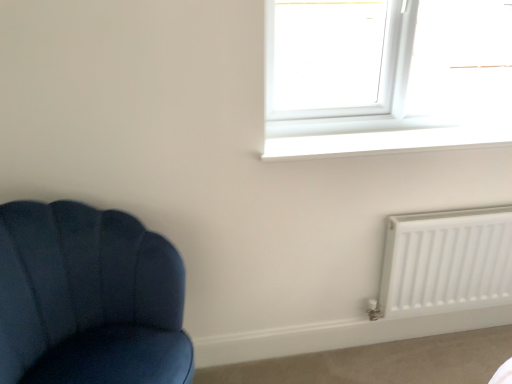
What is the approximate width of white smooth window sill at upper center?

white smooth window sill at upper center is 11.72 inches wide.

Looking at this image, measure the distance between white plastic window at upper right and camera.

white plastic window at upper right is 4.23 feet away from camera.

Measure the distance between point (511, 87) and camera.

A distance of 5.63 feet exists between point (511, 87) and camera.

Identify the location of white smooth window sill at upper center. The width and height of the screenshot is (512, 384). (389, 141).

Considering the positions of objects white matte radiator at lower right and velvet blue chair at left in the image provided, who is more to the right, white matte radiator at lower right or velvet blue chair at left?

white matte radiator at lower right.

Based on the photo, from the image's perspective, is white matte radiator at lower right positioned above or below velvet blue chair at left?

Based on their image positions, white matte radiator at lower right is located above velvet blue chair at left.

Is white matte radiator at lower right further to the viewer compared to velvet blue chair at left?

Yes, white matte radiator at lower right is behind velvet blue chair at left.

This screenshot has width=512, height=384. Find the location of `chair in front of the white matte radiator at lower right`. chair in front of the white matte radiator at lower right is located at coordinates (89, 298).

In the scene shown: Is white smooth window sill at upper center touching white plastic window at upper right?

No, white smooth window sill at upper center is not next to white plastic window at upper right.

Is white smooth window sill at upper center situated inside white plastic window at upper right or outside?

white smooth window sill at upper center is not inside white plastic window at upper right, it's outside.

Is point (371, 140) in front of point (479, 129)?

Yes.

Considering the points (410, 283) and (395, 134), which point is behind, point (410, 283) or point (395, 134)?

Point (410, 283)

From a real-world perspective, between white matte radiator at lower right and white smooth window sill at upper center, who is vertically lower?

white matte radiator at lower right.

I want to click on window sill in front of the white matte radiator at lower right, so click(389, 141).

Which object is closer to the camera taking this photo, white matte radiator at lower right or white smooth window sill at upper center?

white smooth window sill at upper center.

Is point (123, 224) positioned after point (426, 224)?

No, (123, 224) is in front of (426, 224).

Is velvet blue chair at left directly adjacent to white matte radiator at lower right?

velvet blue chair at left and white matte radiator at lower right are not in contact.

From a real-world perspective, is velvet blue chair at left over white matte radiator at lower right?

Yes, from a real-world perspective, velvet blue chair at left is above white matte radiator at lower right.

What's the angular difference between white matte radiator at lower right and white plastic window at upper right's facing directions?

They differ by 1.22 degrees in their facing directions.

Which object is positioned more to the right, white matte radiator at lower right or white plastic window at upper right?

Positioned to the right is white matte radiator at lower right.

Which point is more forward, (396, 313) or (469, 51)?

The point (469, 51) is closer.

Is velvet blue chair at left looking in the opposite direction of white plastic window at upper right?

That's not correct — velvet blue chair at left is not looking away from white plastic window at upper right.

From a real-world perspective, which object stands above the other?

white plastic window at upper right.

Does velvet blue chair at left have a greater height compared to white plastic window at upper right?

Correct, velvet blue chair at left is much taller as white plastic window at upper right.

Is velvet blue chair at left beside white smooth window sill at upper center?

No, velvet blue chair at left is not beside white smooth window sill at upper center.

Considering the positions of objects velvet blue chair at left and white smooth window sill at upper center in the image provided, who is behind, velvet blue chair at left or white smooth window sill at upper center?

Positioned behind is white smooth window sill at upper center.

Would you say velvet blue chair at left contains white smooth window sill at upper center?

No, white smooth window sill at upper center is located outside of velvet blue chair at left.

Which is closer, (39,223) or (285,149)?

The point (39,223) is closer.

Identify the location of chair below the white matte radiator at lower right (from the image's perspective). (89, 298).

I want to click on window behind the white smooth window sill at upper center, so click(x=386, y=75).

Looking at the image, which one is located further to velvet blue chair at left, white smooth window sill at upper center or white plastic window at upper right?

white plastic window at upper right is further to velvet blue chair at left.

Looking at the image, which one is located further to velvet blue chair at left, white smooth window sill at upper center or white matte radiator at lower right?

white matte radiator at lower right is further to velvet blue chair at left.

When comparing their distances from velvet blue chair at left, does white matte radiator at lower right or white smooth window sill at upper center seem closer?

white smooth window sill at upper center lies closer to velvet blue chair at left than the other object.

Which object lies further to the anchor point white matte radiator at lower right, velvet blue chair at left or white smooth window sill at upper center?

The object further to white matte radiator at lower right is velvet blue chair at left.

Looking at the image, which one is located closer to white matte radiator at lower right, white plastic window at upper right or white smooth window sill at upper center?

The object closer to white matte radiator at lower right is white smooth window sill at upper center.

Looking at the image, which one is located further to white smooth window sill at upper center, velvet blue chair at left or white matte radiator at lower right?

Based on the image, velvet blue chair at left appears to be further to white smooth window sill at upper center.

Looking at the image, which one is located further to white matte radiator at lower right, white smooth window sill at upper center or white plastic window at upper right?

white plastic window at upper right lies further to white matte radiator at lower right than the other object.

From the image, which object appears to be farther from white matte radiator at lower right, white plastic window at upper right or velvet blue chair at left?

Among the two, velvet blue chair at left is located further to white matte radiator at lower right.

In order to click on window sill located between velvet blue chair at left and white plastic window at upper right in the left-right direction in this screenshot , I will do `click(389, 141)`.

Where is `window sill situated between velvet blue chair at left and white matte radiator at lower right from left to right`? This screenshot has height=384, width=512. window sill situated between velvet blue chair at left and white matte radiator at lower right from left to right is located at coordinates (389, 141).

At what (x,y) coordinates should I click in order to perform the action: click on window sill between white plastic window at upper right and white matte radiator at lower right from top to bottom. Please return your answer as a coordinate pair (x, y). Looking at the image, I should click on (389, 141).

Locate an element on the screen. Image resolution: width=512 pixels, height=384 pixels. window between velvet blue chair at left and white matte radiator at lower right in the horizontal direction is located at coordinates (386, 75).